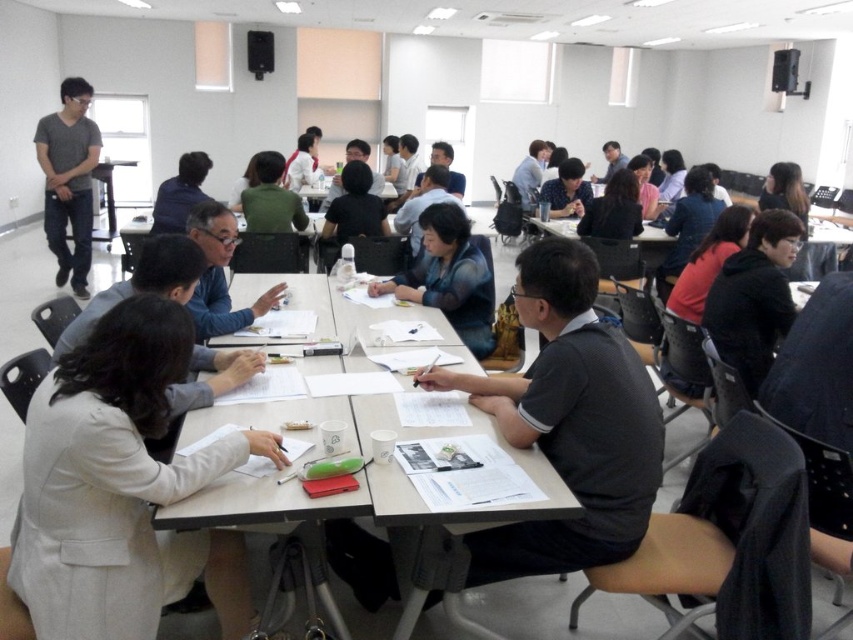
You are organizing a coat rack in the classroom and need to place the black matte jacket at right and the blue denim jacket at center. Which jacket requires more horizontal space on the rack?

The blue denim jacket at center requires more horizontal space on the rack because its width is greater than the black matte jacket at right.

You are a student sitting at the table in the classroom. You need to reach for the white paper at center to take notes. Is the dark gray shirt at center in your way?

The dark gray shirt at center is only 10.12 inches away from the white paper at center, so it is likely blocking access to the paper.